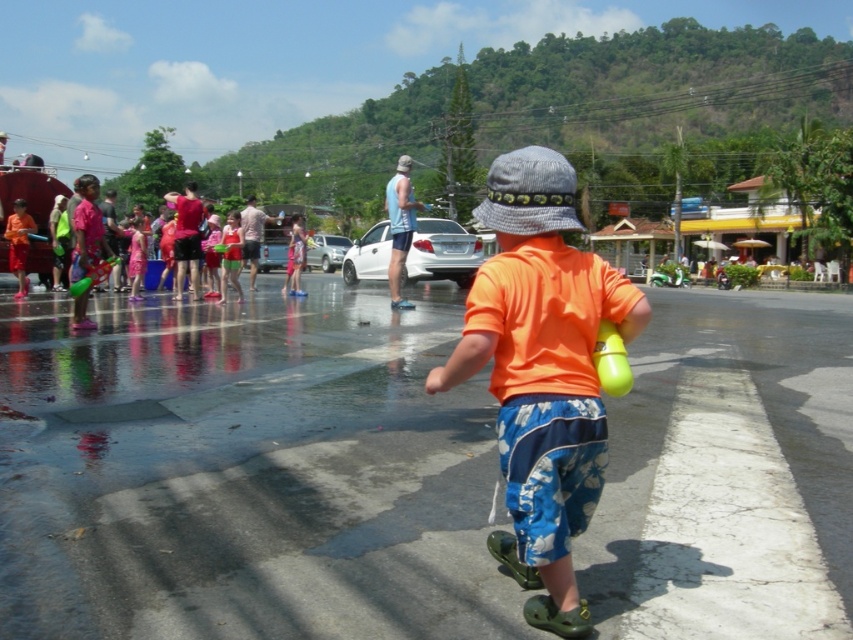
Consider the image. Can you confirm if orange matte shirt at center is smaller than translucent yellow balloon at center?

Incorrect, orange matte shirt at center is not smaller in size than translucent yellow balloon at center.

Who is more forward, (514, 234) or (613, 388)?

Point (613, 388) is more forward.

In order to click on orange matte shirt at center in this screenshot , I will do [543, 372].

Between orange matte shirt at center and blue fabric tank top at center, which one is positioned higher?

Positioned higher is blue fabric tank top at center.

Which of these two, orange matte shirt at center or blue fabric tank top at center, stands taller?

With more height is blue fabric tank top at center.

Does point (595, 284) lie behind point (401, 179)?

No, it is not.

Locate an element on the screen. The image size is (853, 640). orange matte shirt at center is located at coordinates (543, 372).

Is blue fabric tank top at center wider than translucent yellow balloon at center?

Yes, blue fabric tank top at center is wider than translucent yellow balloon at center.

Does point (396, 253) come farther from viewer compared to point (614, 346)?

Yes, point (396, 253) is farther from viewer.

Find the location of a particular element. The height and width of the screenshot is (640, 853). blue fabric tank top at center is located at coordinates (399, 227).